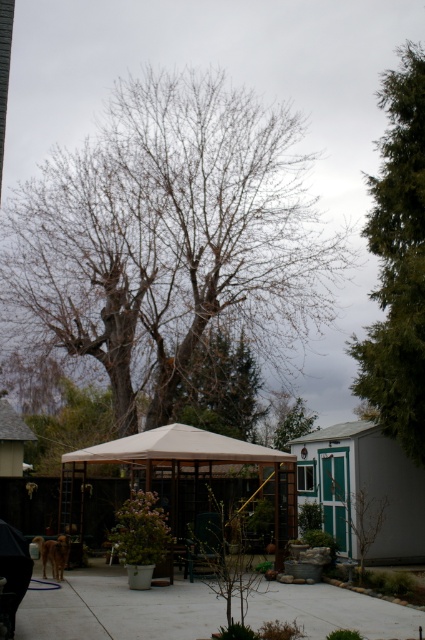
Question: Which of the following is the closest to the observer?

Choices:
 (A) (362, 381)
 (B) (107, 444)

Answer: (A)

Question: Is green textured evergreen tree at right wider than beige fabric gazebo at center?

Choices:
 (A) yes
 (B) no

Answer: (A)

Question: Considering the relative positions of bare branches at center and green textured evergreen tree at right in the image provided, where is bare branches at center located with respect to green textured evergreen tree at right?

Choices:
 (A) right
 (B) left

Answer: (B)

Question: In this image, where is green textured evergreen tree at right located relative to beige fabric canopy at center?

Choices:
 (A) below
 (B) above

Answer: (B)

Question: Which object is the farthest from the green textured evergreen tree at right?

Choices:
 (A) beige fabric gazebo at center
 (B) bare branches at center
 (C) gray concrete pavement at lower center

Answer: (C)

Question: Which point is closer to the camera taking this photo?

Choices:
 (A) (274, 108)
 (B) (136, 600)

Answer: (B)